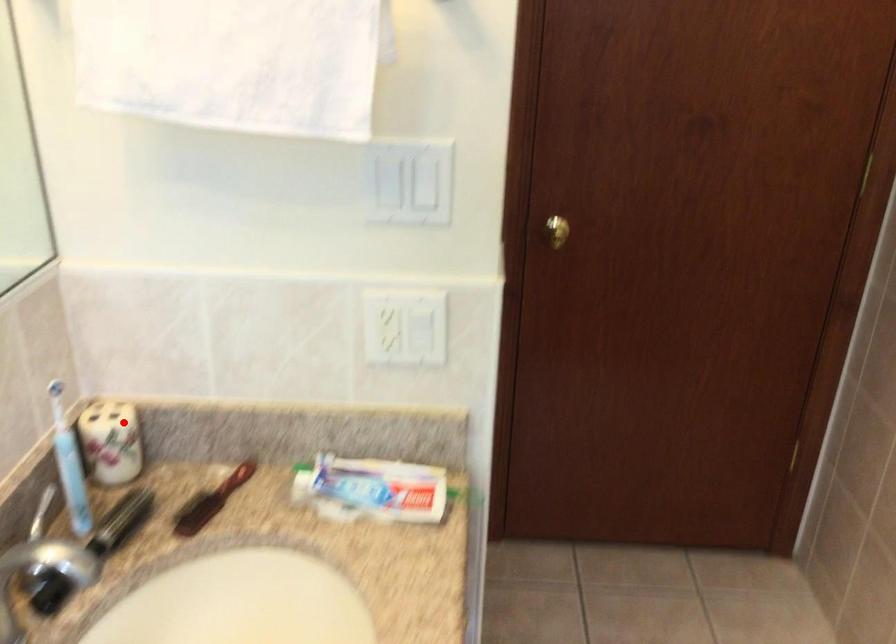
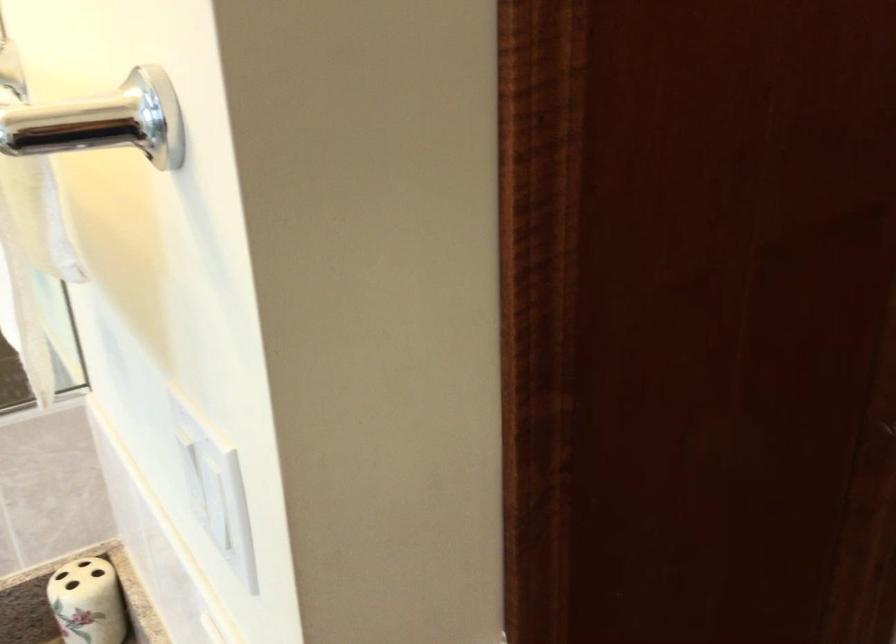
In the second image, find the point that corresponds to the highlighted location in the first image.

(88, 601)